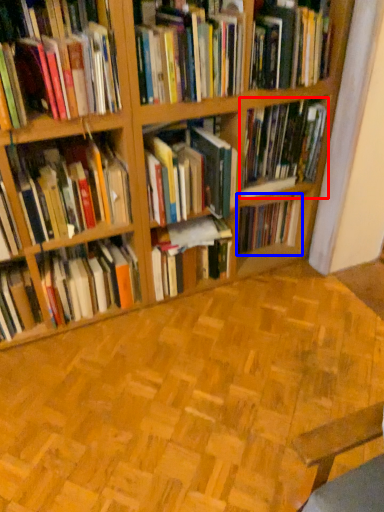
Question: Which object is further to the camera taking this photo, book (highlighted by a red box) or book (highlighted by a blue box)?

Choices:
 (A) book
 (B) book

Answer: (B)